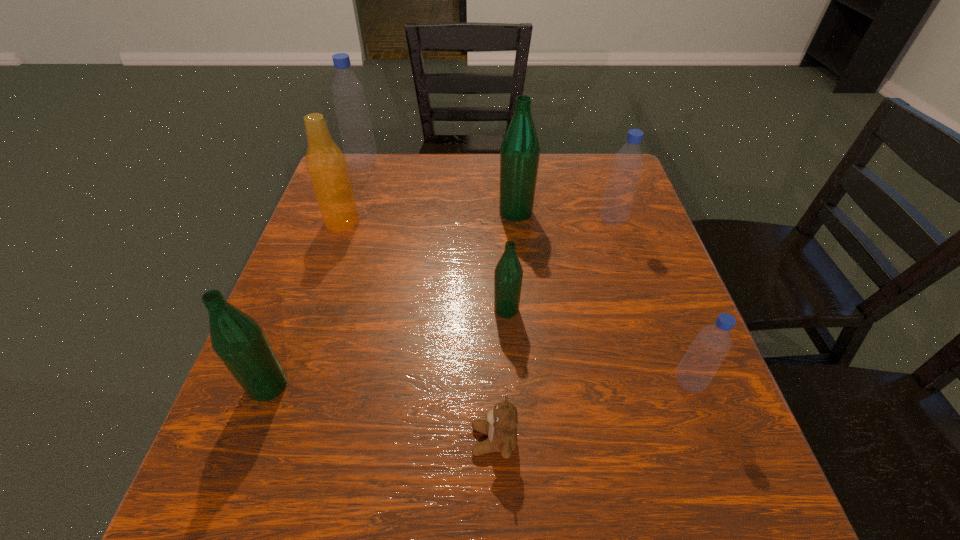
The image size is (960, 540). Find the location of `vacant area that lies between the farthest green bottle and the leftmost blue bottle`. vacant area that lies between the farthest green bottle and the leftmost blue bottle is located at coordinates (440, 187).

You are a GUI agent. You are given a task and a screenshot of the screen. Output one action in this format:
    pyautogui.click(x=<x>, y=<y>)
    Task: Click on the vacant area between the smallest green bottle and the teddy bear
    Image resolution: width=960 pixels, height=540 pixels.
    Given the screenshot: What is the action you would take?
    pyautogui.click(x=500, y=375)

This screenshot has height=540, width=960. What are the coordinates of `object that can be found as the sixth closest to the beer bottle` in the screenshot? It's located at (627, 165).

Where is `the fifth closest object to the biggest green bottle`? the fifth closest object to the biggest green bottle is located at coordinates (698, 366).

Find the location of a particular element. the third closest bottle to the biggest green bottle is located at coordinates (358, 142).

The height and width of the screenshot is (540, 960). Find the location of `the closest bottle to the second biggest green bottle`. the closest bottle to the second biggest green bottle is located at coordinates (508, 274).

Locate which blue bottle is the second closest to the smallest blue bottle. Please provide its 2D coordinates. Your answer should be formatted as a tuple, i.e. [(x, y)], where the tuple contains the x and y coordinates of a point satisfying the conditions above.

[(358, 142)]

Locate which blue bottle ranks second in proximity to the nearest object. Please provide its 2D coordinates. Your answer should be formatted as a tuple, i.e. [(x, y)], where the tuple contains the x and y coordinates of a point satisfying the conditions above.

[(627, 165)]

Point out which green bottle is positioned as the second nearest to the shortest object. Please provide its 2D coordinates. Your answer should be formatted as a tuple, i.e. [(x, y)], where the tuple contains the x and y coordinates of a point satisfying the conditions above.

[(239, 341)]

This screenshot has width=960, height=540. Find the location of `green bottle that is the second nearest to the beer bottle`. green bottle that is the second nearest to the beer bottle is located at coordinates (239, 341).